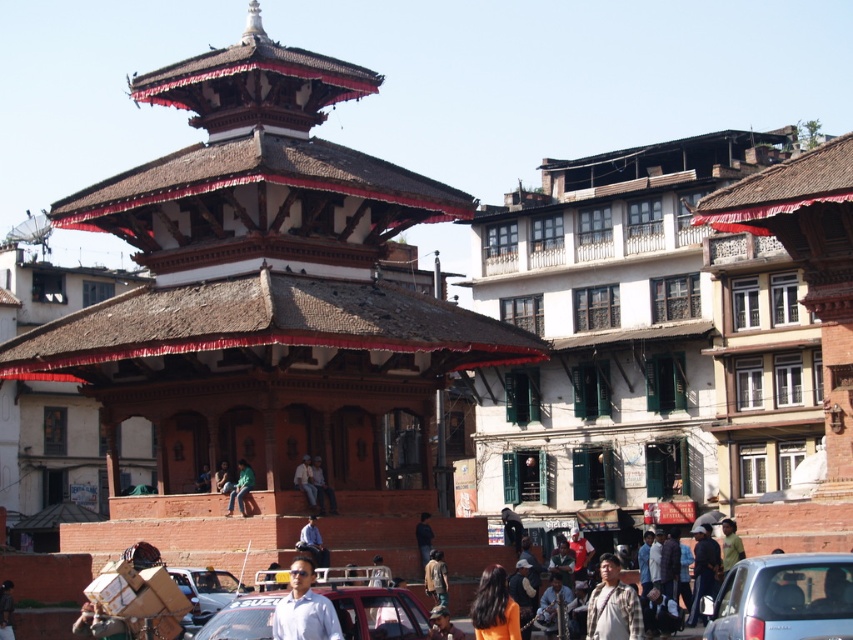
Does matte red car at center appear on the right side of green fabric pants at center?

Indeed, matte red car at center is positioned on the right side of green fabric pants at center.

Measure the distance between point (398, 600) and camera.

The distance of point (398, 600) from camera is 44.21 meters.

At what (x,y) coordinates should I click in order to perform the action: click on matte red car at center. Please return your answer as a coordinate pair (x, y). This screenshot has height=640, width=853. Looking at the image, I should click on 378,612.

Can you confirm if metallic silver car at lower right is smaller than green fabric pants at center?

No.

Between metallic silver car at lower right and green fabric pants at center, which one appears on the right side from the viewer's perspective?

Positioned to the right is metallic silver car at lower right.

Is point (727, 582) closer to camera compared to point (241, 484)?

Yes, it is in front of point (241, 484).

This screenshot has height=640, width=853. Find the location of `metallic silver car at lower right`. metallic silver car at lower right is located at coordinates (782, 598).

Is point (410, 621) positioned in front of point (225, 593)?

That is True.

How far apart are matte red car at center and metallic silver taxi at center?

16.06 meters

The width and height of the screenshot is (853, 640). What are the coordinates of `matte red car at center` in the screenshot? It's located at (378, 612).

Find the location of a particular element. The height and width of the screenshot is (640, 853). matte red car at center is located at coordinates (378, 612).